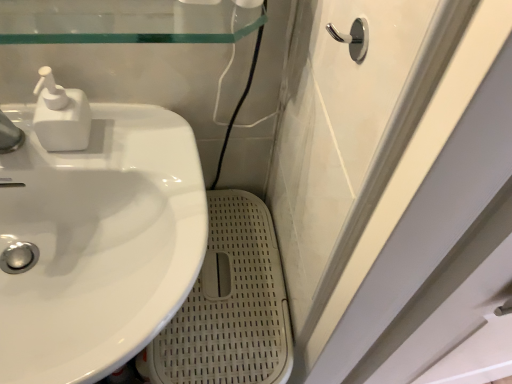
Question: Is polished chrome hook at upper right positioned with its back to white matte soap dispenser at upper left?

Choices:
 (A) yes
 (B) no

Answer: (B)

Question: Is polished chrome hook at upper right wider than white matte soap dispenser at upper left?

Choices:
 (A) no
 (B) yes

Answer: (A)

Question: Does polished chrome hook at upper right turn towards white matte soap dispenser at upper left?

Choices:
 (A) yes
 (B) no

Answer: (B)

Question: From the image's perspective, is polished chrome hook at upper right located beneath white matte soap dispenser at upper left?

Choices:
 (A) no
 (B) yes

Answer: (A)

Question: From a real-world perspective, is polished chrome hook at upper right located beneath white matte soap dispenser at upper left?

Choices:
 (A) yes
 (B) no

Answer: (B)

Question: Looking at their shapes, would you say white matte soap dispenser at upper left is wider or thinner than polished chrome hook at upper right?

Choices:
 (A) thin
 (B) wide

Answer: (B)

Question: Is white matte soap dispenser at upper left inside or outside of polished chrome hook at upper right?

Choices:
 (A) inside
 (B) outside

Answer: (B)

Question: Considering the positions of white matte soap dispenser at upper left and polished chrome hook at upper right in the image, is white matte soap dispenser at upper left bigger or smaller than polished chrome hook at upper right?

Choices:
 (A) big
 (B) small

Answer: (A)

Question: Does point (56, 99) appear closer or farther from the camera than point (361, 59)?

Choices:
 (A) farther
 (B) closer

Answer: (A)

Question: Does point (134, 299) appear closer or farther from the camera than point (74, 89)?

Choices:
 (A) farther
 (B) closer

Answer: (B)

Question: Considering the relative positions of white glossy sink at left and white matte soap dispenser at upper left in the image provided, is white glossy sink at left to the left or to the right of white matte soap dispenser at upper left?

Choices:
 (A) left
 (B) right

Answer: (B)

Question: From the image's perspective, relative to white matte soap dispenser at upper left, is white glossy sink at left above or below?

Choices:
 (A) below
 (B) above

Answer: (A)

Question: From a real-world perspective, relative to white matte soap dispenser at upper left, is white glossy sink at left vertically above or below?

Choices:
 (A) below
 (B) above

Answer: (A)

Question: Choose the correct answer: Is white matte soap dispenser at upper left inside white glossy sink at left or outside it?

Choices:
 (A) inside
 (B) outside

Answer: (B)

Question: In terms of size, does white matte soap dispenser at upper left appear bigger or smaller than white glossy sink at left?

Choices:
 (A) small
 (B) big

Answer: (A)